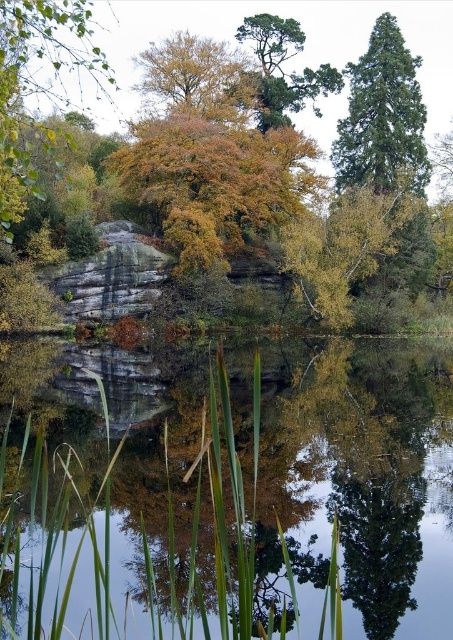
Based on the photo, who is lower down, green textured tree at upper right or green textured pine tree at upper center?

green textured tree at upper right is lower down.

Can you confirm if green textured tree at upper right is bigger than green textured pine tree at upper center?

No, green textured tree at upper right is not bigger than green textured pine tree at upper center.

Find the location of a particular element. green textured tree at upper right is located at coordinates (382, 116).

Based on the photo, which is more to the right, golden textured leaves at upper left or golden yellow leaves at upper center?

golden yellow leaves at upper center is more to the right.

Who is positioned more to the left, golden textured leaves at upper left or golden yellow leaves at upper center?

Positioned to the left is golden textured leaves at upper left.

Is point (67, 17) behind point (220, 90)?

No, (67, 17) is in front of (220, 90).

Find the location of a particular element. golden textured leaves at upper left is located at coordinates (38, 84).

Can you confirm if green textured tree at upper right is thinner than golden yellow leaves at upper center?

Yes, green textured tree at upper right is thinner than golden yellow leaves at upper center.

Between green textured tree at upper right and golden yellow leaves at upper center, which one is positioned lower?

green textured tree at upper right is below.

The width and height of the screenshot is (453, 640). Identify the location of green textured tree at upper right. (382, 116).